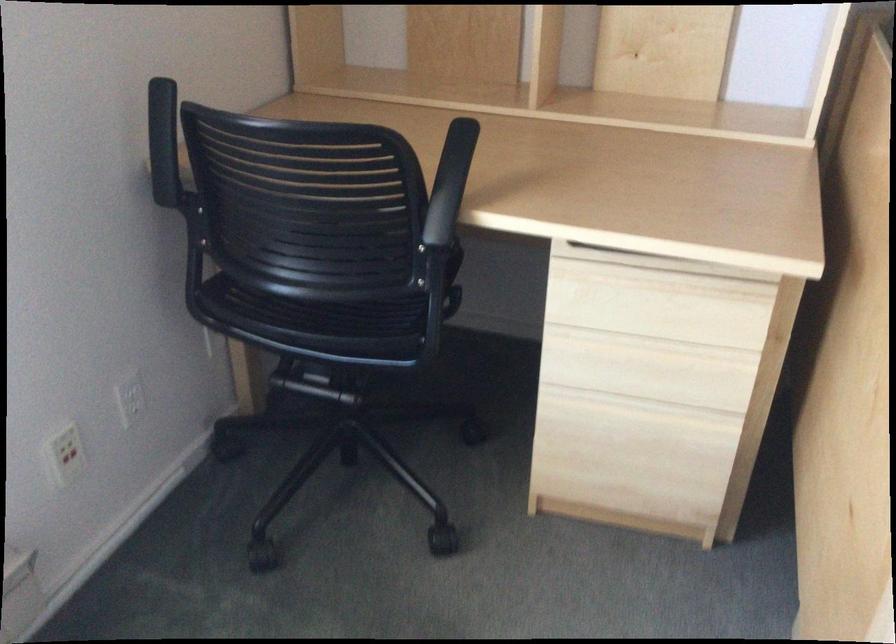
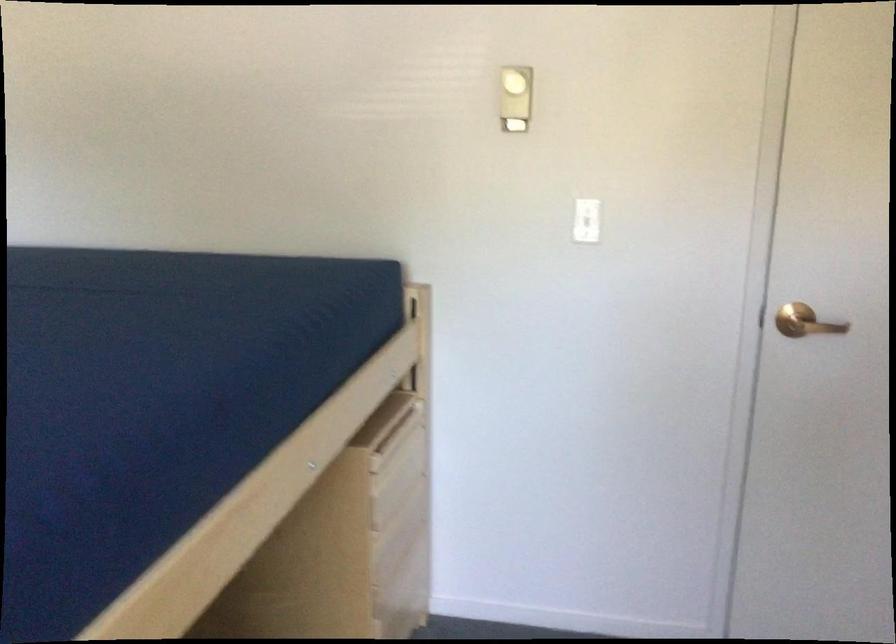
The images are taken continuously from a first-person perspective. In which direction is your viewpoint rotating?

The rotation direction of the camera is right-down.